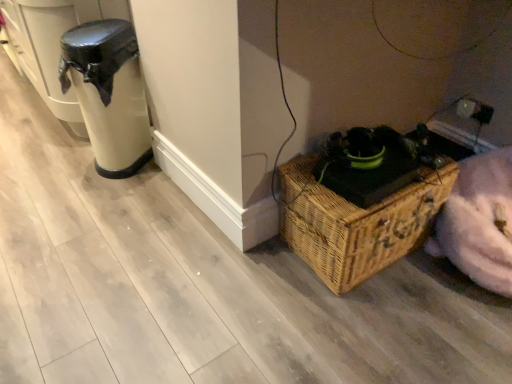
What are the coordinates of `vacant area on top of matte black trash can at left (from a real-world perspective)` in the screenshot? It's located at (115, 28).